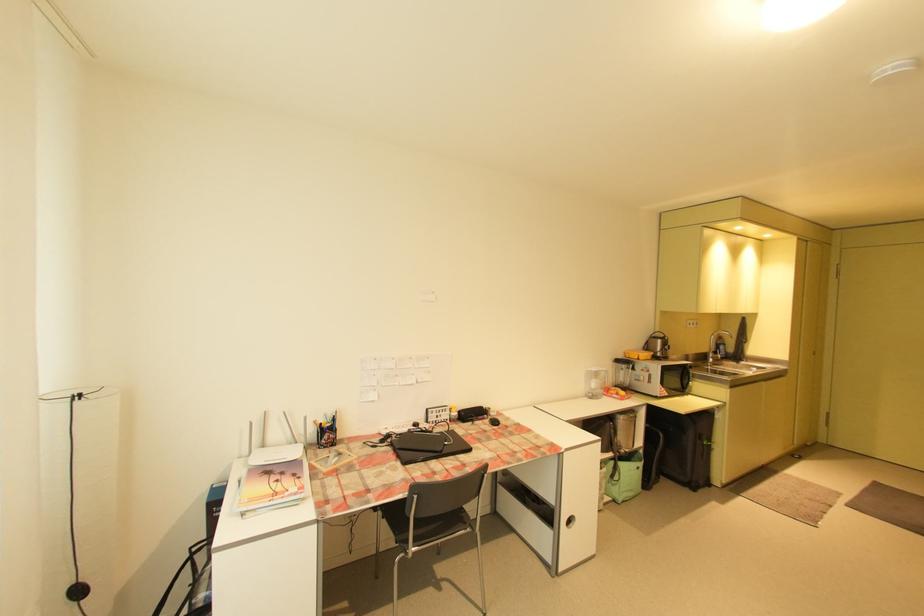
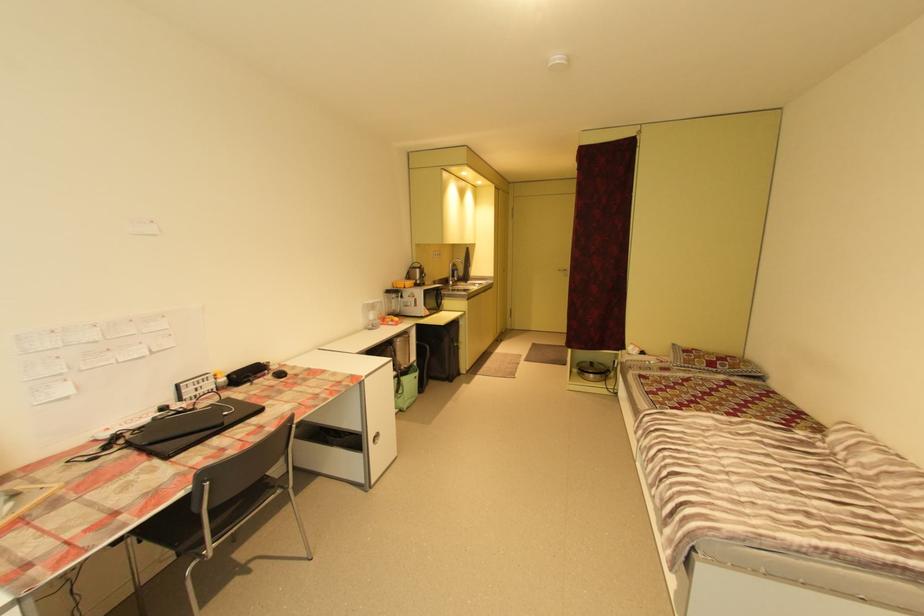
Find the pixel in the second image that matches point 453,444 in the first image.

(232, 414)